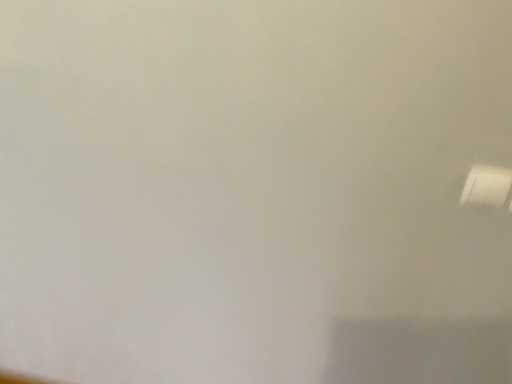
This screenshot has height=384, width=512. What do you see at coordinates (486, 186) in the screenshot? I see `clear plastic tape at upper right` at bounding box center [486, 186].

Find the location of a particular element. Image resolution: width=512 pixels, height=384 pixels. clear plastic tape at upper right is located at coordinates (486, 186).

Image resolution: width=512 pixels, height=384 pixels. Identify the location of clear plastic tape at upper right. (486, 186).